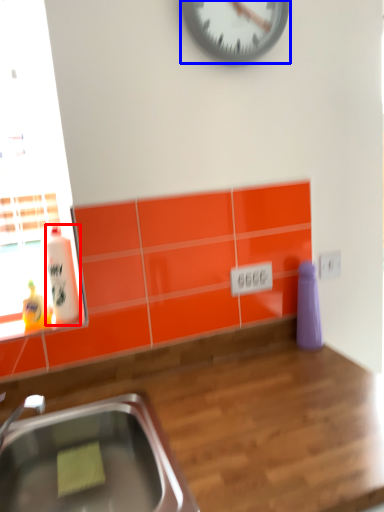
Question: Which object is further to the camera taking this photo, bottle (highlighted by a red box) or wall clock (highlighted by a blue box)?

Choices:
 (A) bottle
 (B) wall clock

Answer: (A)